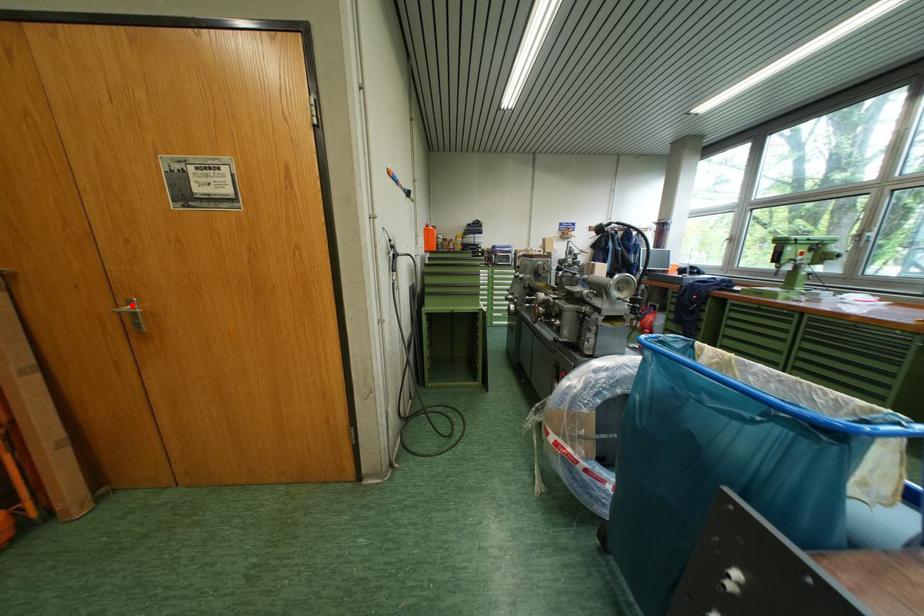
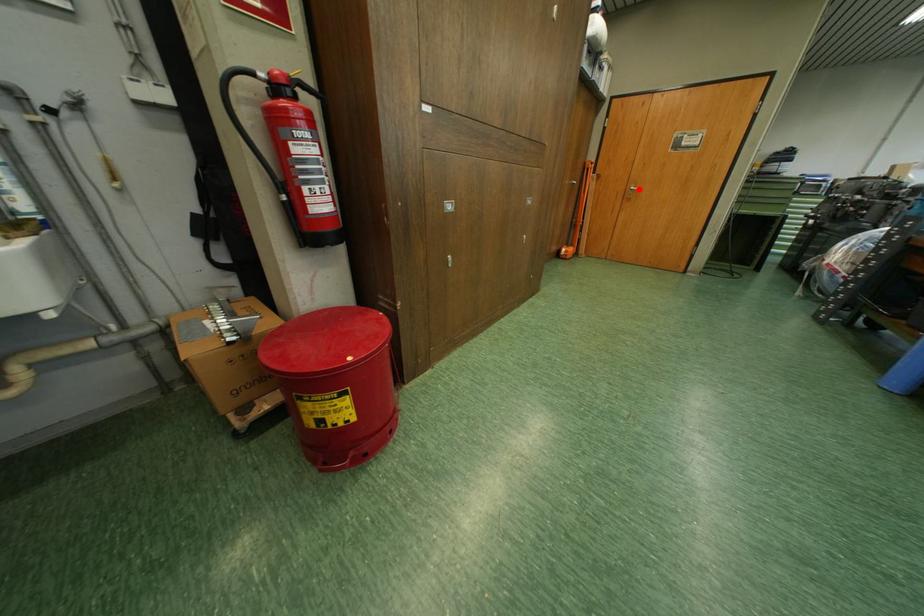
I am providing you with two images of the same scene from different viewpoints. A red point is marked on the first image and another point is marked on the second image. Does the point marked in image1 correspond to the same location as the one in image2?

Yes